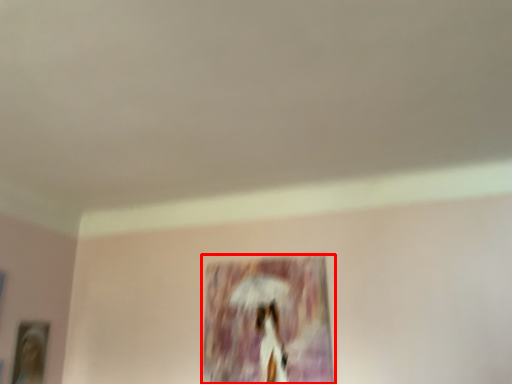
Question: From the image's perspective, what is the correct spatial positioning of picture frame (annotated by the red box) in reference to picture frame?

Choices:
 (A) above
 (B) below

Answer: (A)